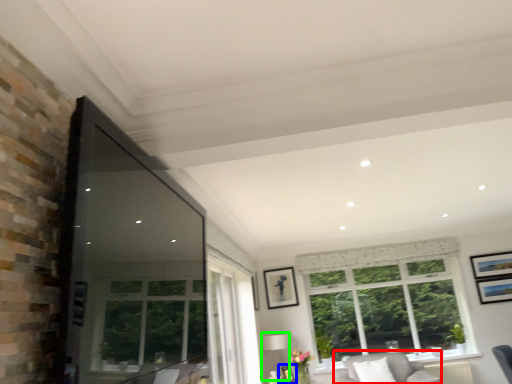
Question: Estimate the real-world distances between objects in this image. Which object is closer to couch (highlighted by a red box), picture frame (highlighted by a blue box) or lamp (highlighted by a green box)?

Choices:
 (A) picture frame
 (B) lamp

Answer: (A)